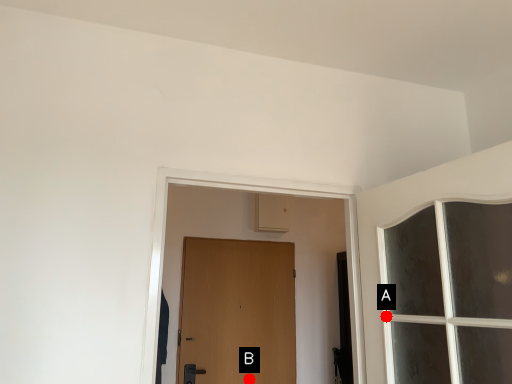
Question: Two points are circled on the image, labeled by A and B beside each circle. Which point is closer to the camera taking this photo?

Choices:
 (A) A is closer
 (B) B is closer

Answer: (A)